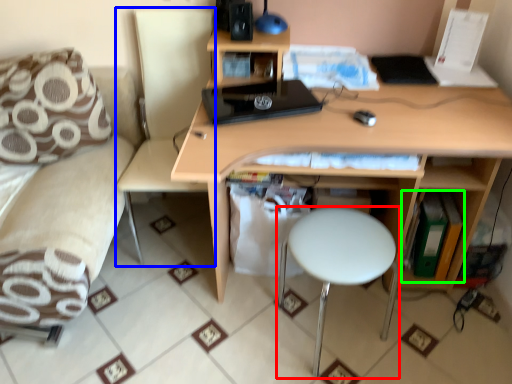
Question: Based on their relative distances, which object is farther from stool (highlighted by a red box)? Choose from swivel chair (highlighted by a blue box) and book (highlighted by a green box).

Choices:
 (A) swivel chair
 (B) book

Answer: (A)